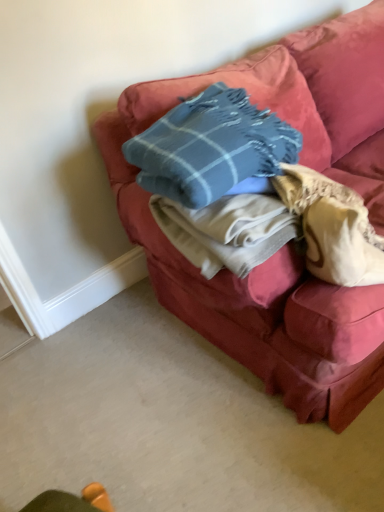
Question: Should I look upward or downward to see velvet-like pink couch at center?

Choices:
 (A) down
 (B) up

Answer: (B)